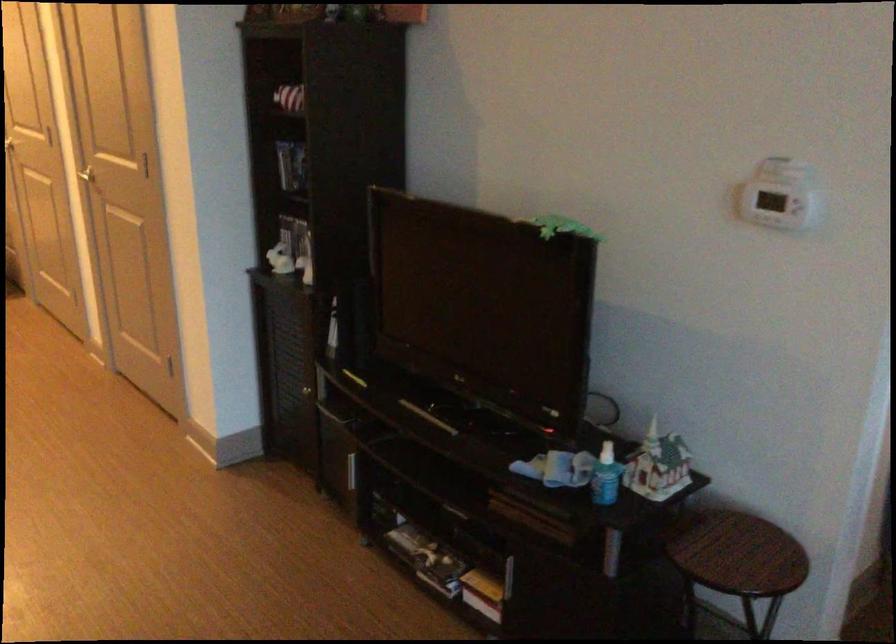
The height and width of the screenshot is (644, 896). What do you see at coordinates (291, 383) in the screenshot?
I see `the cabinet door handle` at bounding box center [291, 383].